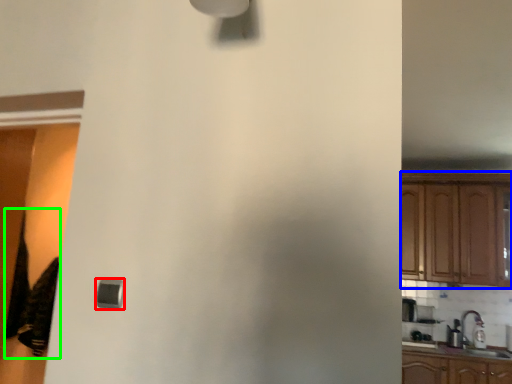
Question: Estimate the real-world distances between objects in this image. Which object is farther from light (highlighted by a red box), cabinetry (highlighted by a blue box) or laundry (highlighted by a green box)?

Choices:
 (A) cabinetry
 (B) laundry

Answer: (A)